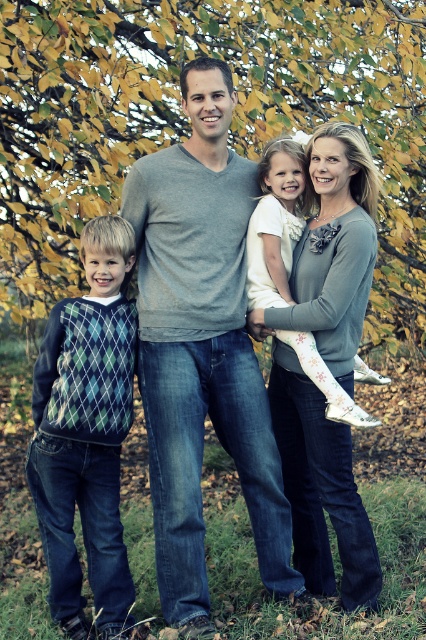
Consider the image. You are a photographer trying to capture the family in the image. You notice two points marked in the scene. The first point is at coordinate point (54, 189) and the second is at point (60, 387). Which point is closer to the camera?

Point (54, 189) is further to the camera than point (60, 387). Therefore, point (60, 387) is closer to the camera.